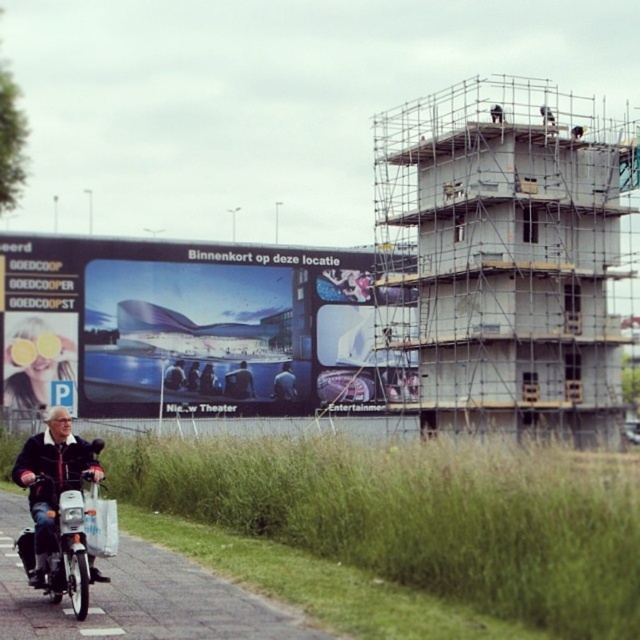
You are a surveyor trying to determine the spatial relationship between two points marked on a blueprint of the urban scene. The points are labeled as point 1 at coordinates (285, 394) and point 2 at (202, 387). Based on the image, which point is situated behind the other when viewed from the front?

Point 1 at coordinates (285, 394) is situated behind point 2 at (202, 387) when viewed from the front.

Looking at this image, structural analysis of the building under construction on the right and the denim jacket at center. Which object is closer to the billboard advertisement on the center left?

structural analysis of the building under construction on the right and the denim jacket at center. The denim jacket at center is closer to the billboard advertisement on the center left because it is located at point (284, 384), which is closer to the center left position than the building on the right.